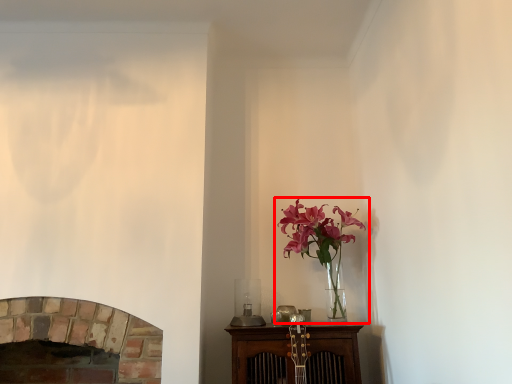
Question: From the image, what is the correct spatial relationship of houseplant (annotated by the red box) in relation to fireplace?

Choices:
 (A) left
 (B) right

Answer: (B)